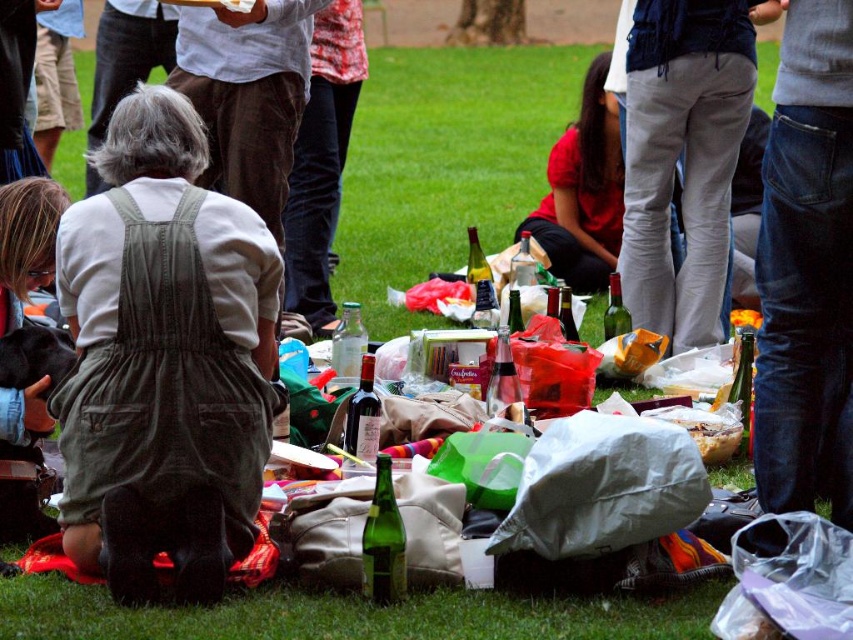
You are at the picnic and want to take a photo of both the person in white shirt and green overalls and the bottles. The person is at point (259, 266) and the bottles are at point (691, 51). Based on their positions, which one is closer to your camera so you can focus on it first?

Point (259, 266) is closer to the camera than point (691, 51), so you can focus on the person in white shirt and green overalls first.

In the scene shown: You are planning to walk from the green corduroy overalls at center to the gray sweatpants at center. How much distance do you need to cover?

The distance between the green corduroy overalls at center and the gray sweatpants at center is 4.12 meters, so you need to cover 4.12 meters to reach there.

You are part of the picnic group and want to hand a snack to the person in green corduroy overalls at center and gray sweatpants at center. Which person should you approach first based on their position?

You should approach the person in green corduroy overalls at center first because they are in front of the person in gray sweatpants at center, making them closer to you.